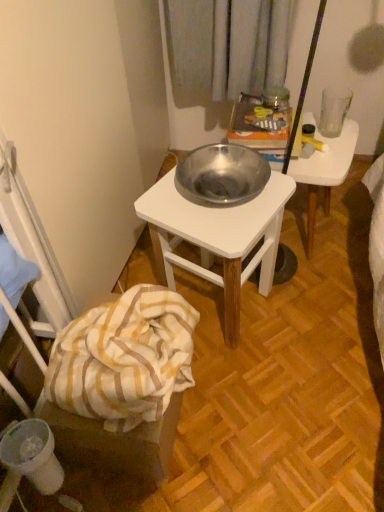
Find the location of a particular element. This screenshot has width=384, height=512. vacant space underneath metallic white table at center (from a real-world perspective) is located at coordinates (237, 314).